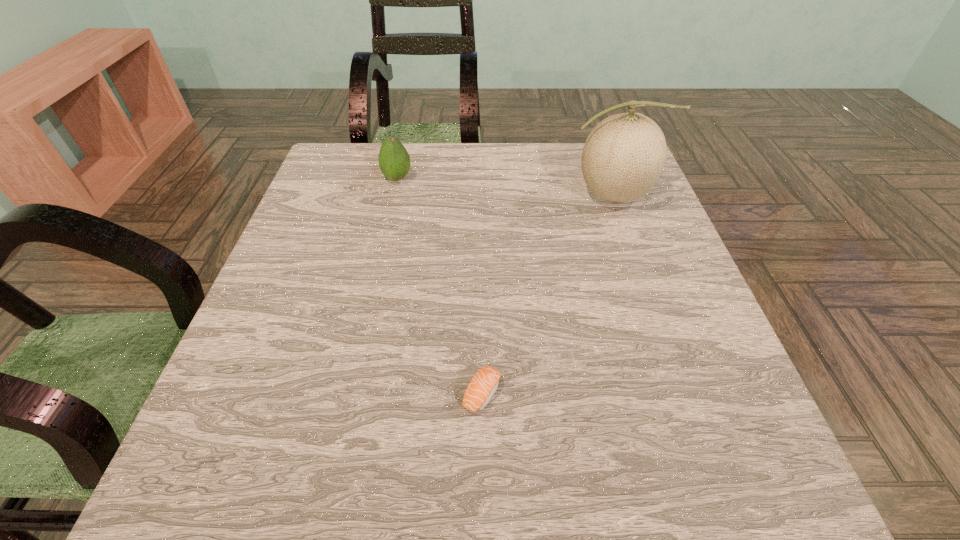
Where is `blank region between the cantaloup and the sushi`? This screenshot has height=540, width=960. blank region between the cantaloup and the sushi is located at coordinates (546, 294).

Find the location of a particular element. The height and width of the screenshot is (540, 960). free space between the cantaloup and the nearest object is located at coordinates (546, 294).

Image resolution: width=960 pixels, height=540 pixels. I want to click on free spot between the nearest object and the leftmost object, so click(440, 286).

Identify the location of vacant area between the avocado and the cantaloup. (504, 187).

Where is `vacant region between the cantaloup and the nearest object`? This screenshot has height=540, width=960. vacant region between the cantaloup and the nearest object is located at coordinates (546, 294).

Where is `vacant space that is in between the cantaloup and the avocado`? The width and height of the screenshot is (960, 540). vacant space that is in between the cantaloup and the avocado is located at coordinates (504, 187).

I want to click on free space between the rightmost object and the avocado, so click(504, 187).

The image size is (960, 540). Identify the location of unoccupied area between the avocado and the cantaloup. (504, 187).

Where is `vacant space in between the tallest object and the leftmost object`? vacant space in between the tallest object and the leftmost object is located at coordinates (504, 187).

Choose which object is the second nearest neighbor to the second object from left to right. Please provide its 2D coordinates. Your answer should be formatted as a tuple, i.e. [(x, y)], where the tuple contains the x and y coordinates of a point satisfying the conditions above.

[(394, 161)]